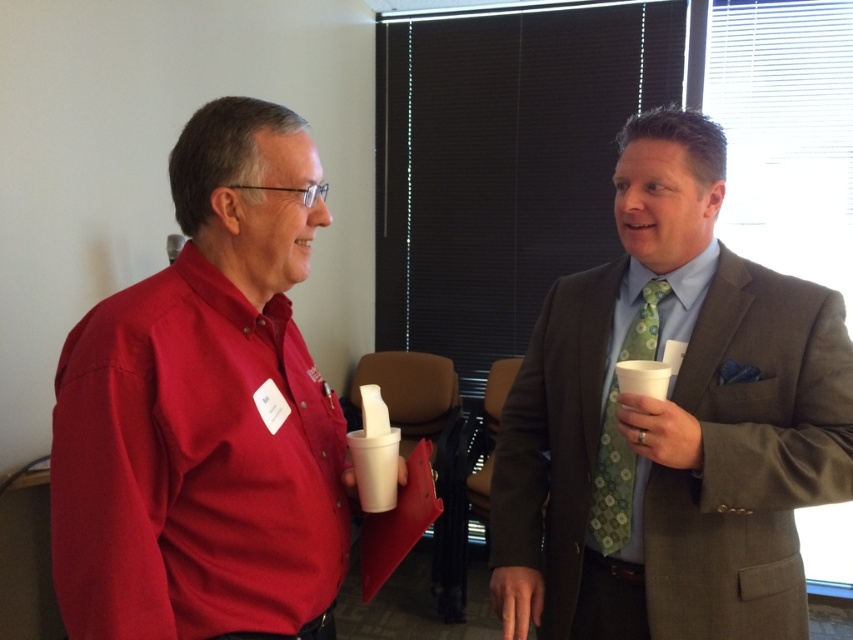
Between matte red shirt at left and green floral tie at right, which one is positioned higher?

Positioned higher is matte red shirt at left.

Is matte red shirt at left below green floral tie at right?

Incorrect, matte red shirt at left is not positioned below green floral tie at right.

Where is `matte red shirt at left`? The height and width of the screenshot is (640, 853). matte red shirt at left is located at coordinates (206, 412).

Can you confirm if green textured tie at right is wider than green floral tie at right?

Indeed, green textured tie at right has a greater width compared to green floral tie at right.

Is green textured tie at right to the left of green floral tie at right from the viewer's perspective?

In fact, green textured tie at right is to the right of green floral tie at right.

Is point (717, 608) positioned after point (653, 333)?

That is False.

Locate an element on the screen. The width and height of the screenshot is (853, 640). green textured tie at right is located at coordinates (669, 422).

Based on the photo, measure the distance between point [767,323] and camera.

A distance of 3.97 feet exists between point [767,323] and camera.

Is green textured tie at right to the right of matte red shirt at left from the viewer's perspective?

Yes, green textured tie at right is to the right of matte red shirt at left.

Describe the element at coordinates (669, 422) in the screenshot. This screenshot has height=640, width=853. I see `green textured tie at right` at that location.

At what (x,y) coordinates should I click in order to perform the action: click on green textured tie at right. Please return your answer as a coordinate pair (x, y). Looking at the image, I should click on (669, 422).